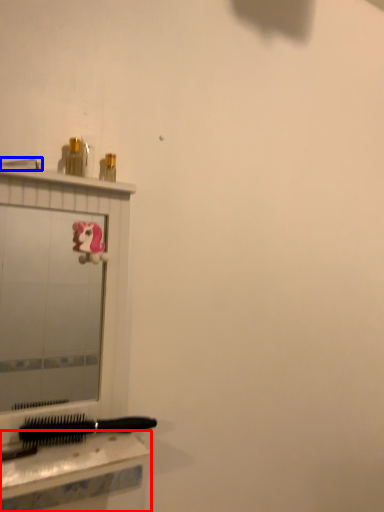
Question: Which of the following is the closest to the observer, table (highlighted by a red box) or shower (highlighted by a blue box)?

Choices:
 (A) table
 (B) shower

Answer: (A)